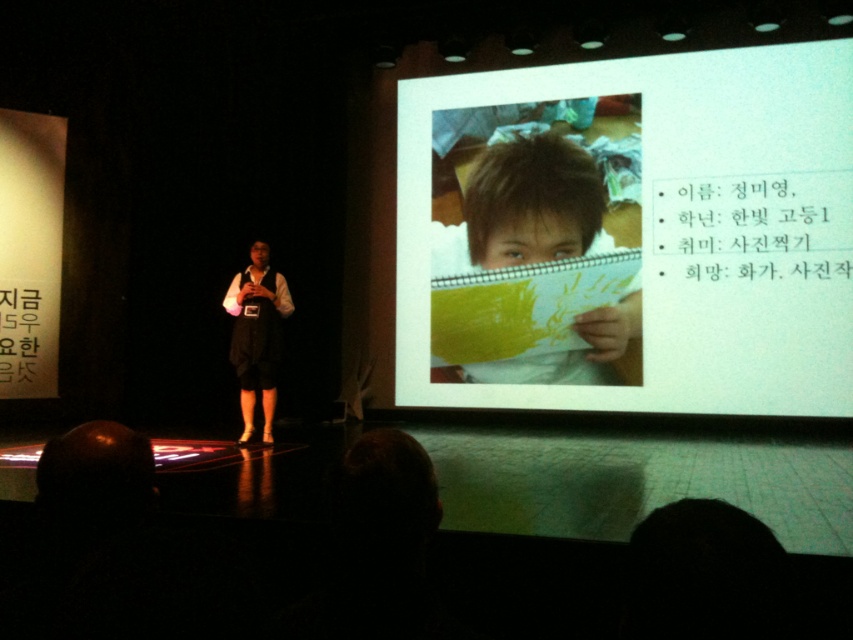
You are an event organizer who needs to hang two matte papers on the stage. The matte paper at upper center and the matte yellow paper at center are both available. Which one is wider so that it can display more information?

The matte paper at upper center is wider than the matte yellow paper at center, so it can display more information.

You are an attendee at the presentation. You notice two items on the stage. One is a matte paper at upper center and the other is a white fabric shirt at center. Which item is positioned higher relative to the other?

The matte paper at upper center is positioned higher than the white fabric shirt at center.

You are a stagehand who needs to hang a new banner exactly where the matte paper at upper center is currently located. What coordinates should you use to hang the new banner?

The coordinates for the matte paper at upper center are at point (634, 230), so you should hang the new banner at those coordinates.